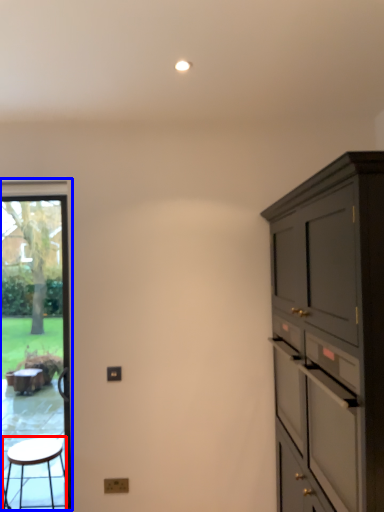
Question: Which object is closer to the camera taking this photo, stool (highlighted by a red box) or window screen (highlighted by a blue box)?

Choices:
 (A) stool
 (B) window screen

Answer: (A)